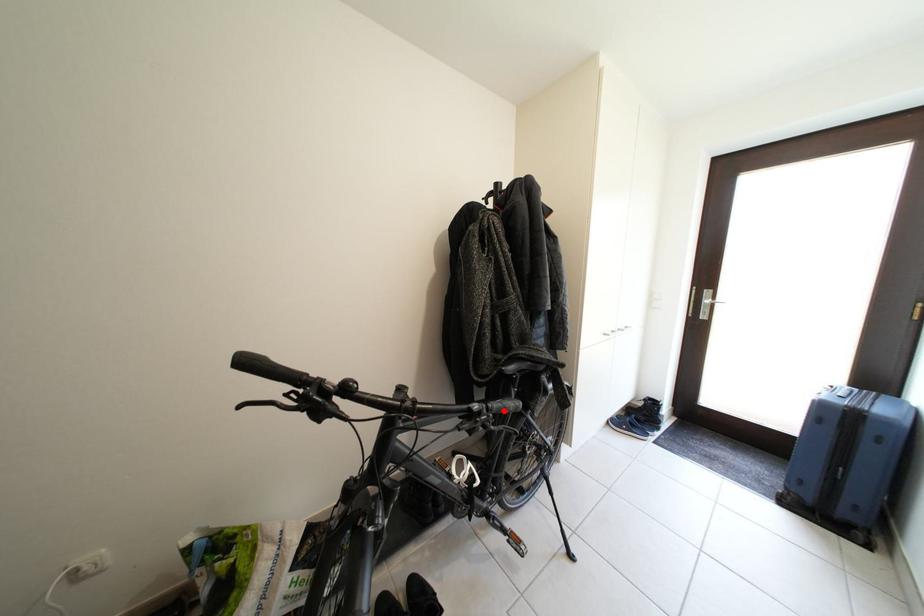
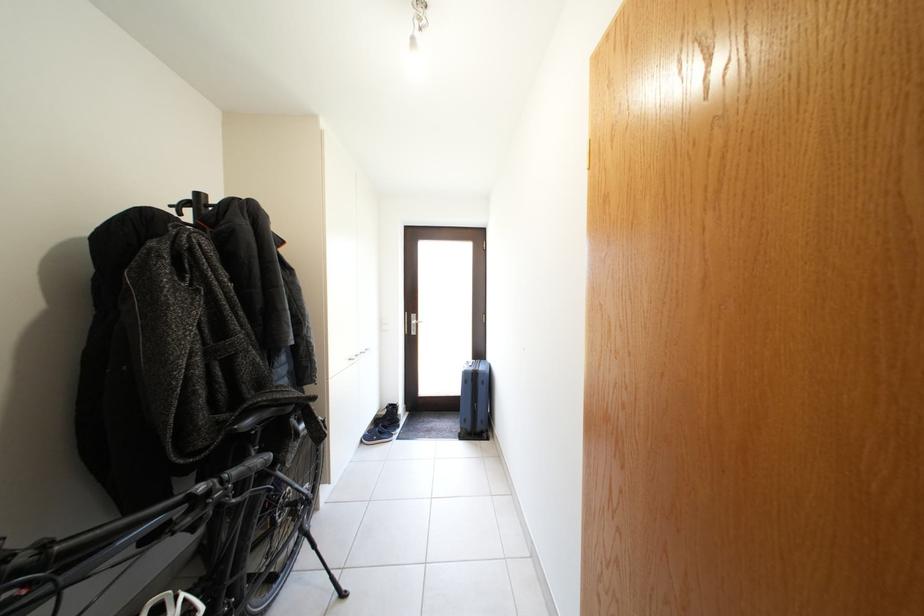
Locate, in the second image, the point that corresponds to the highlighted location in the first image.

(242, 477)